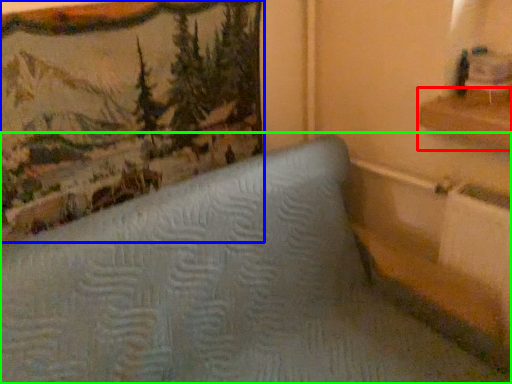
Question: Which object is positioned closest to shelf (highlighted by a red box)? Select from picture frame (highlighted by a blue box) and furniture (highlighted by a green box).

Choices:
 (A) picture frame
 (B) furniture

Answer: (B)